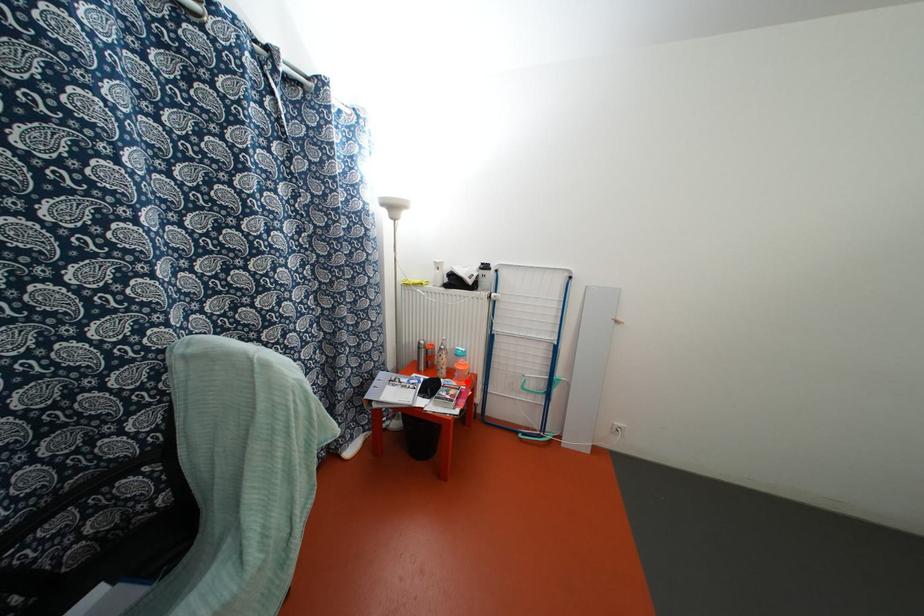
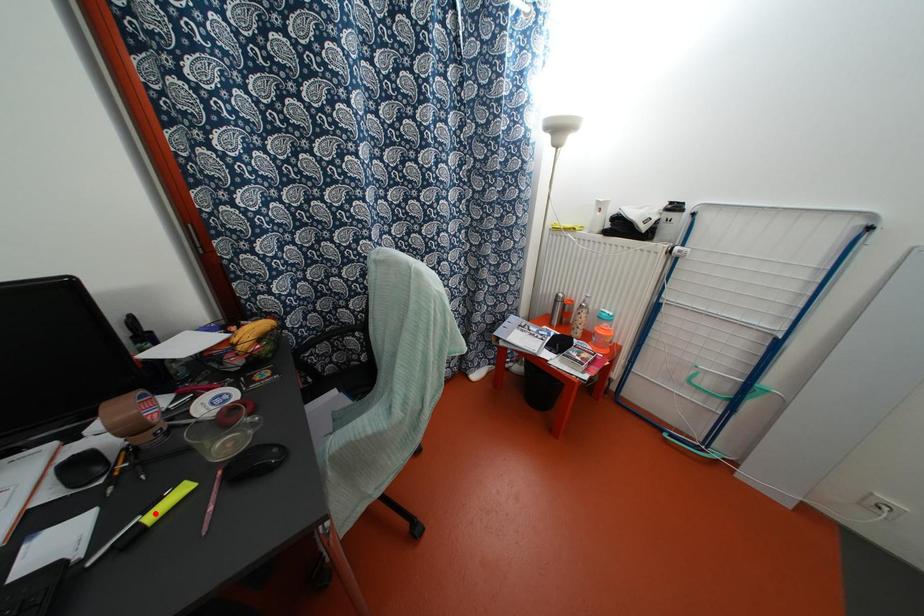
I am providing you with two images of the same scene from different viewpoints. A red point is marked on the first image and another point is marked on the second image. Does the point marked in image1 correspond to the same location as the one in image2?

No